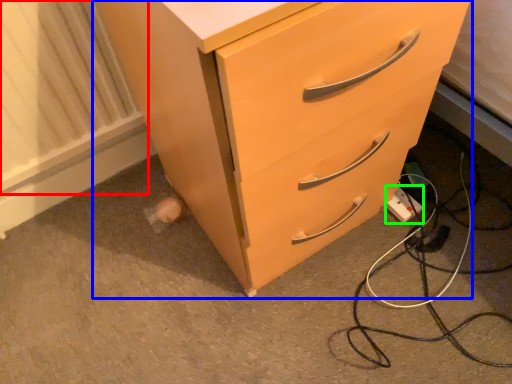
Question: Which object is positioned closest to radiator (highlighted by a red box)? Select from chest of drawers (highlighted by a blue box) and electric outlet (highlighted by a green box).

Choices:
 (A) chest of drawers
 (B) electric outlet

Answer: (A)